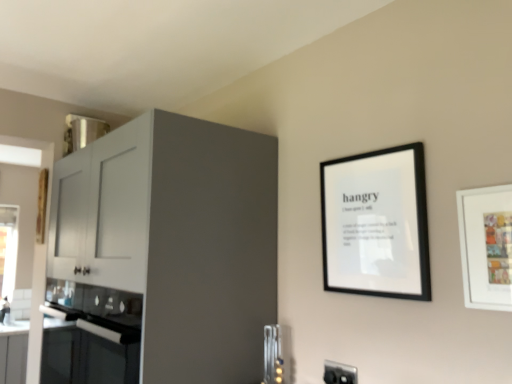
Locate an element on the screen. The width and height of the screenshot is (512, 384). black glass oven at lower left is located at coordinates (88, 356).

The height and width of the screenshot is (384, 512). I want to click on black plastic electric outlet at lower right, so click(x=339, y=373).

Where is `white matte picture frame at right, the 1th picture frame viewed from the front`? white matte picture frame at right, the 1th picture frame viewed from the front is located at coordinates (485, 246).

From the image's perspective, between black glass oven at lower left and metallic silver utensils at lower center, which one is located above?

From the image's view, metallic silver utensils at lower center is above.

Measure the distance from black glass oven at lower left to metallic silver utensils at lower center.

They are 23.81 inches apart.

From a real-world perspective, is black glass oven at lower left on top of metallic silver utensils at lower center?

Yes.

Which object is further away from the camera taking this photo, black glass oven at lower left or metallic silver utensils at lower center?

black glass oven at lower left is further from the camera.

Can you confirm if metallic silver utensils at lower center is taller than white matte picture frame at right, which appears as the first picture frame when viewed from the right?

Yes.

Does metallic silver utensils at lower center have a greater width compared to white matte picture frame at right, positioned as the 2th picture frame in left-to-right order?

Indeed, metallic silver utensils at lower center has a greater width compared to white matte picture frame at right, positioned as the 2th picture frame in left-to-right order.

From the image's perspective, is metallic silver utensils at lower center located above or below white matte picture frame at right, which is the 2th picture frame from back to front?

From the image's perspective, metallic silver utensils at lower center appears below white matte picture frame at right, which is the 2th picture frame from back to front.

Is metallic silver utensils at lower center touching matte white cabinet at left?

No, metallic silver utensils at lower center is not making contact with matte white cabinet at left.

Is metallic silver utensils at lower center smaller than matte white cabinet at left?

Indeed, metallic silver utensils at lower center has a smaller size compared to matte white cabinet at left.

Where is `cabinetry above the metallic silver utensils at lower center (from a real-world perspective)`? The image size is (512, 384). cabinetry above the metallic silver utensils at lower center (from a real-world perspective) is located at coordinates (163, 254).

Could you tell me if metallic silver utensils at lower center is facing matte white cabinet at left?

Yes, metallic silver utensils at lower center is facing matte white cabinet at left.

Can you confirm if matte white cabinet at left is smaller than black plastic electric outlet at lower right?

No.

Considering the sizes of objects matte white cabinet at left and black plastic electric outlet at lower right in the image provided, who is taller, matte white cabinet at left or black plastic electric outlet at lower right?

matte white cabinet at left.

Looking at this image, which object is positioned more to the right, matte white cabinet at left or black plastic electric outlet at lower right?

From the viewer's perspective, black plastic electric outlet at lower right appears more on the right side.

Is matte white cabinet at left completely or partially outside of black plastic electric outlet at lower right?

That's correct, matte white cabinet at left is outside of black plastic electric outlet at lower right.

Could you tell me if white matte picture frame at right, which appears as the first picture frame when viewed from the right, is facing black plastic electric outlet at lower right?

No.

In terms of width, does white matte picture frame at right, the 1th picture frame viewed from the front, look wider or thinner when compared to black plastic electric outlet at lower right?

In the image, white matte picture frame at right, the 1th picture frame viewed from the front, appears to be wider than black plastic electric outlet at lower right.

Consider the image. Is there a large distance between white matte picture frame at right, which appears as the first picture frame when viewed from the right, and black plastic electric outlet at lower right?

They are positioned close to each other.

Is white matte picture frame at right, positioned as the 2th picture frame in left-to-right order, to the left of black plastic electric outlet at lower right from the viewer's perspective?

No, white matte picture frame at right, positioned as the 2th picture frame in left-to-right order, is not to the left of black plastic electric outlet at lower right.

Identify the location of cabinetry above the black glass oven at lower left (from the image's perspective). This screenshot has width=512, height=384. (163, 254).

Who is taller, matte white cabinet at left or black glass oven at lower left?

matte white cabinet at left.

Can we say matte white cabinet at left lies outside black glass oven at lower left?

Yes, matte white cabinet at left is not within black glass oven at lower left.

How different are the orientations of black plastic electric outlet at lower right and matte white cabinet at left in degrees?

black plastic electric outlet at lower right and matte white cabinet at left are facing 0.504 degrees away from each other.

Is black plastic electric outlet at lower right in front of matte white cabinet at left?

That is False.

Does black plastic electric outlet at lower right have a lesser width compared to matte white cabinet at left?

Indeed, black plastic electric outlet at lower right has a lesser width compared to matte white cabinet at left.

Where is `cabinetry on the left of black plastic electric outlet at lower right`? cabinetry on the left of black plastic electric outlet at lower right is located at coordinates (x=163, y=254).

Image resolution: width=512 pixels, height=384 pixels. In order to click on oven above the metallic silver utensils at lower center (from a real-world perspective) in this screenshot , I will do `click(88, 356)`.

Locate an element on the screen. The height and width of the screenshot is (384, 512). appliance that is below the white matte picture frame at right, the 1th picture frame viewed from the front (from the image's perspective) is located at coordinates (273, 355).

Estimate the real-world distances between objects in this image. Which object is closer to black glass oven at lower left, black matte picture frame at upper right, which is counted as the 2th picture frame, starting from the right, or metallic silver utensils at lower center?

Based on the image, metallic silver utensils at lower center appears to be nearer to black glass oven at lower left.

Based on their spatial positions, is matte white cabinet at left or black glass oven at lower left closer to black matte picture frame at upper right, which is counted as the 2th picture frame, starting from the right?

matte white cabinet at left is closer to black matte picture frame at upper right, which is counted as the 2th picture frame, starting from the right.

From the image, which object appears to be farther from metallic silver utensils at lower center, black glass oven at lower left or black matte picture frame at upper right, marked as the first picture frame in a back-to-front arrangement?

The object further to metallic silver utensils at lower center is black matte picture frame at upper right, marked as the first picture frame in a back-to-front arrangement.

Estimate the real-world distances between objects in this image. Which object is further from white matte picture frame at right, which is the 2th picture frame from back to front, black matte picture frame at upper right, the second picture frame viewed from the front, or black glass oven at lower left?

black glass oven at lower left is positioned further to the anchor white matte picture frame at right, which is the 2th picture frame from back to front.

Considering their positions, is black plastic electric outlet at lower right positioned further to matte white cabinet at left than metallic silver utensils at lower center?

Among the two, black plastic electric outlet at lower right is located further to matte white cabinet at left.

Considering their positions, is metallic silver utensils at lower center positioned further to black plastic electric outlet at lower right than black glass oven at lower left?

black glass oven at lower left.

Looking at the image, which one is located further to metallic silver utensils at lower center, white matte picture frame at right, which is the 2th picture frame from back to front, or matte white cabinet at left?

white matte picture frame at right, which is the 2th picture frame from back to front, is further to metallic silver utensils at lower center.

Based on their spatial positions, is matte white cabinet at left or black matte picture frame at upper right, acting as the 1th picture frame starting from the left, further from metallic silver utensils at lower center?

Among the two, matte white cabinet at left is located further to metallic silver utensils at lower center.

Locate an element on the screen. Image resolution: width=512 pixels, height=384 pixels. appliance situated between matte white cabinet at left and white matte picture frame at right, which appears as the first picture frame when viewed from the right, from left to right is located at coordinates (273, 355).

What are the coordinates of `picture frame between black matte picture frame at upper right, acting as the 1th picture frame starting from the left, and black plastic electric outlet at lower right from top to bottom` in the screenshot? It's located at (485, 246).

Where is `cabinetry situated between black glass oven at lower left and white matte picture frame at right, positioned as the 2th picture frame in left-to-right order, from left to right`? cabinetry situated between black glass oven at lower left and white matte picture frame at right, positioned as the 2th picture frame in left-to-right order, from left to right is located at coordinates (163, 254).

Find the location of a particular element. The width and height of the screenshot is (512, 384). appliance between black glass oven at lower left and white matte picture frame at right, which is the 2th picture frame from back to front is located at coordinates (273, 355).